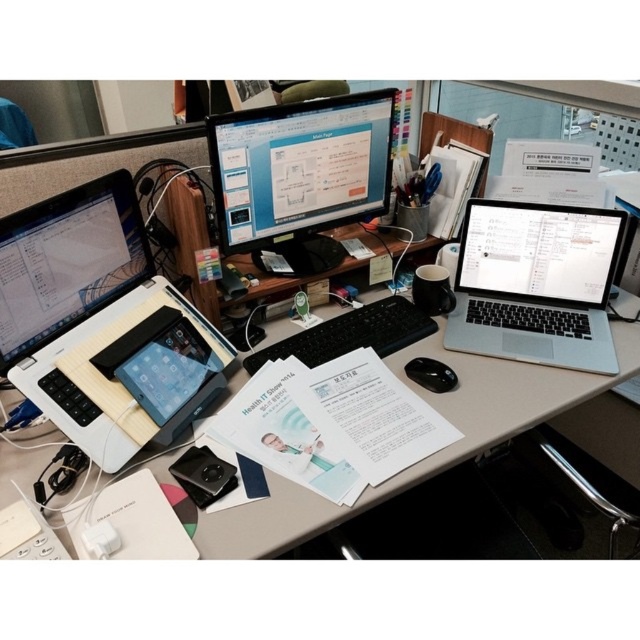
Question: Considering the real-world distances, which object is farthest from the matte black laptop at left?

Choices:
 (A) black matte mouse at center
 (B) black matte keyboard at center

Answer: (A)

Question: Considering the real-world distances, which object is farthest from the black matte mouse at center?

Choices:
 (A) black matte keyboard at center
 (B) white matte laptop at left
 (C) matte black laptop at left
 (D) silver metallic laptop at right

Answer: (C)

Question: Is matte black monitor at center smaller than black matte mouse at center?

Choices:
 (A) no
 (B) yes

Answer: (A)

Question: Which point is farther to the camera?

Choices:
 (A) white matte laptop at left
 (B) black matte keyboard at center

Answer: (B)

Question: Is white matte laptop at left below matte black monitor at center?

Choices:
 (A) no
 (B) yes

Answer: (B)

Question: Is silver metallic laptop at right to the left of matte black monitor at center from the viewer's perspective?

Choices:
 (A) yes
 (B) no

Answer: (B)